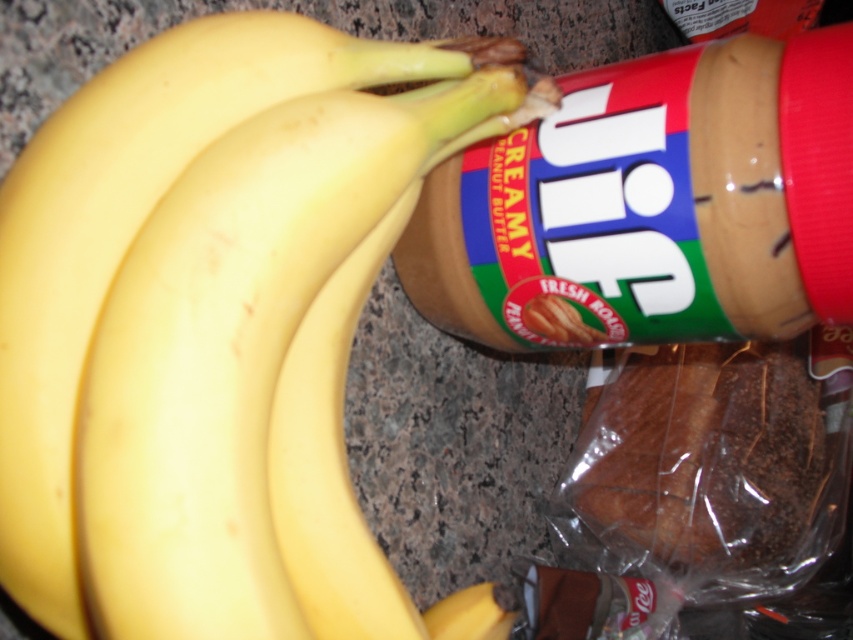
You are standing in front of the bananas and need to reach a point that is behind the Jif peanut butter jar. Which point should you move towards, point at coordinate (277, 26) or point at coordinate (746, 470)?

You should move towards point at coordinate (746, 470) because it is behind the Jif peanut butter jar, while point at coordinate (277, 26) is in front of it.